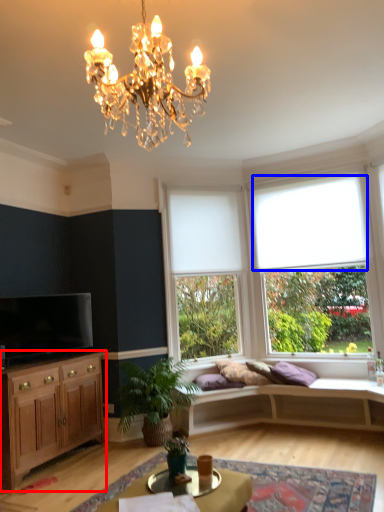
Question: Which of the following is the closest to the observer, cabinetry (highlighted by a red box) or curtain (highlighted by a blue box)?

Choices:
 (A) cabinetry
 (B) curtain

Answer: (A)